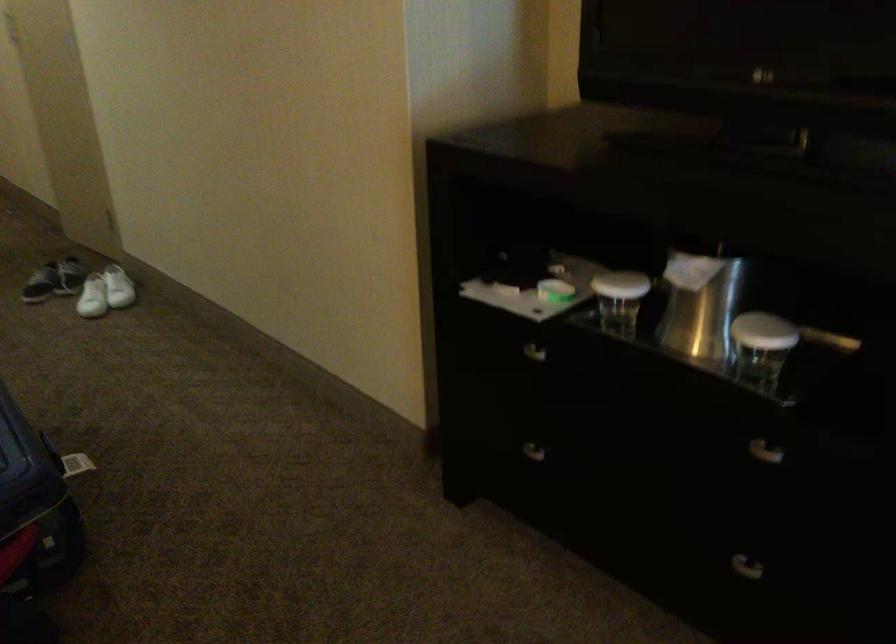
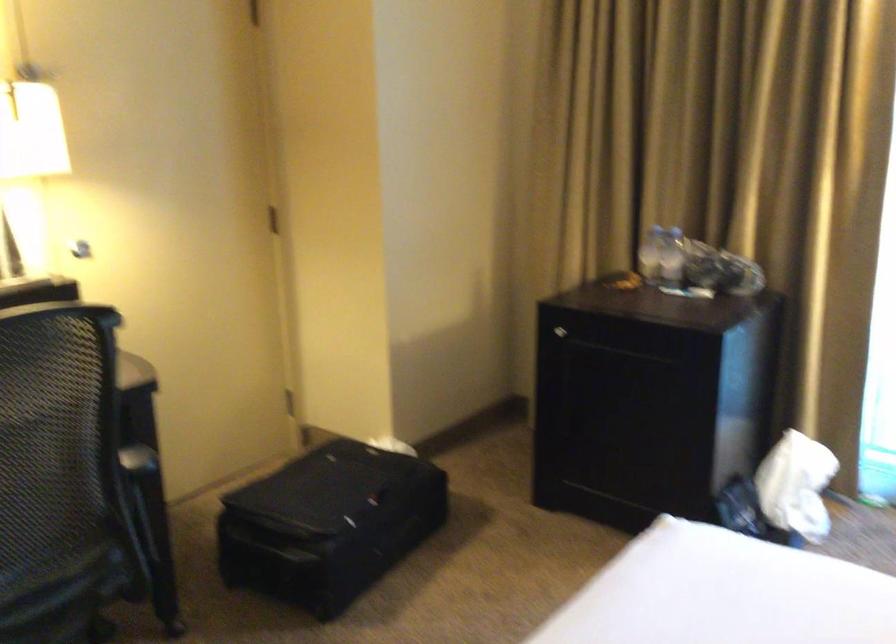
How did the camera likely rotate?

The rotation direction of the camera is right-down.